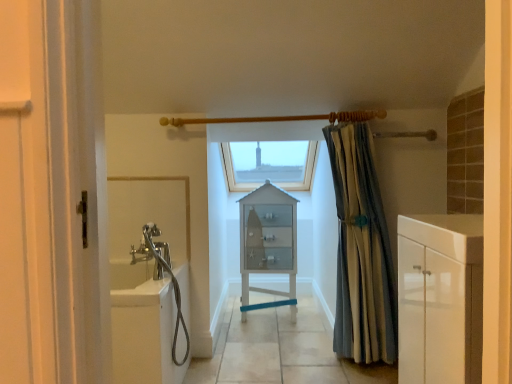
Question: Can you confirm if white glass cabinet at center is bigger than white glossy bathtub at left?

Choices:
 (A) yes
 (B) no

Answer: (A)

Question: Is white glass cabinet at center at the right side of white glossy bathtub at left?

Choices:
 (A) no
 (B) yes

Answer: (B)

Question: Considering the relative sizes of white glass cabinet at center and white glossy bathtub at left in the image provided, is white glass cabinet at center smaller than white glossy bathtub at left?

Choices:
 (A) no
 (B) yes

Answer: (A)

Question: Does white glass cabinet at center touch white glossy bathtub at left?

Choices:
 (A) no
 (B) yes

Answer: (A)

Question: Does white glass cabinet at center lie in front of white glossy bathtub at left?

Choices:
 (A) no
 (B) yes

Answer: (A)

Question: Considering the positions of white glossy cabinet at right and white glass cabinet at center in the image, is white glossy cabinet at right wider or thinner than white glass cabinet at center?

Choices:
 (A) thin
 (B) wide

Answer: (A)

Question: Visually, is white glossy cabinet at right positioned to the left or to the right of white glass cabinet at center?

Choices:
 (A) right
 (B) left

Answer: (A)

Question: Is white glossy cabinet at right bigger or smaller than white glass cabinet at center?

Choices:
 (A) small
 (B) big

Answer: (A)

Question: From their relative heights in the image, would you say white glossy cabinet at right is taller or shorter than white glass cabinet at center?

Choices:
 (A) short
 (B) tall

Answer: (A)

Question: Considering their positions, is white glossy bathtub at left located in front of or behind white glossy cabinet at right?

Choices:
 (A) behind
 (B) front

Answer: (A)

Question: From the image's perspective, is white glossy bathtub at left located above or below white glossy cabinet at right?

Choices:
 (A) above
 (B) below

Answer: (B)

Question: Visually, is white glossy bathtub at left positioned to the left or to the right of white glossy cabinet at right?

Choices:
 (A) right
 (B) left

Answer: (B)

Question: Is white glossy bathtub at left taller or shorter than white glossy cabinet at right?

Choices:
 (A) tall
 (B) short

Answer: (A)

Question: Considering their positions, is transparent glass window at center located in front of or behind white glossy cabinet at right?

Choices:
 (A) front
 (B) behind

Answer: (B)

Question: Considering the positions of point (311, 147) and point (468, 340), is point (311, 147) closer or farther from the camera than point (468, 340)?

Choices:
 (A) farther
 (B) closer

Answer: (A)